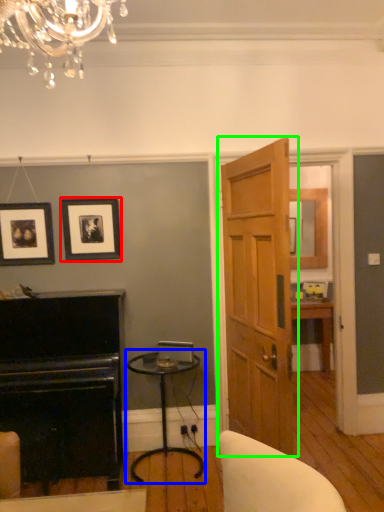
Question: Which object is the farthest from picture frame (highlighted by a red box)? Choose among these: table (highlighted by a blue box) or door (highlighted by a green box).

Choices:
 (A) table
 (B) door

Answer: (B)